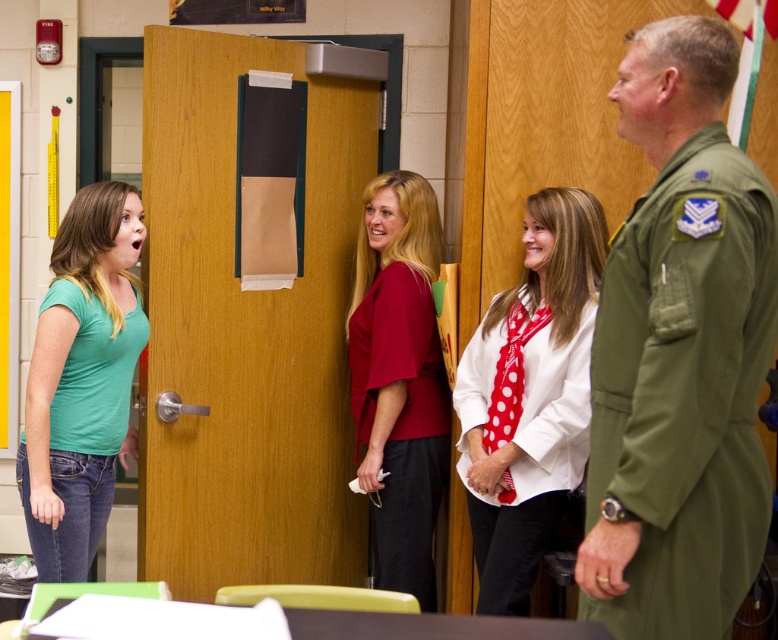
Between matte red blouse at center and white matte shirt at center, which one has more height?

matte red blouse at center

Is point (377, 202) positioned before point (500, 340)?

No, (377, 202) is further to viewer.

Find the location of `matte red blouse at center`. matte red blouse at center is located at coordinates (398, 378).

Which is more to the left, green uniform at right or green matte shirt at left?

green matte shirt at left

Can you confirm if green uniform at right is thinner than green matte shirt at left?

In fact, green uniform at right might be wider than green matte shirt at left.

Describe the element at coordinates (680, 355) in the screenshot. Image resolution: width=778 pixels, height=640 pixels. I see `green uniform at right` at that location.

Where is `green uniform at right`? green uniform at right is located at coordinates (680, 355).

Who is more forward, (668,529) or (423,305)?

Positioned in front is point (668,529).

Describe the element at coordinates (680, 355) in the screenshot. I see `green uniform at right` at that location.

What do you see at coordinates (680, 355) in the screenshot? The height and width of the screenshot is (640, 778). I see `green uniform at right` at bounding box center [680, 355].

Where is `green uniform at right`? The image size is (778, 640). green uniform at right is located at coordinates (680, 355).